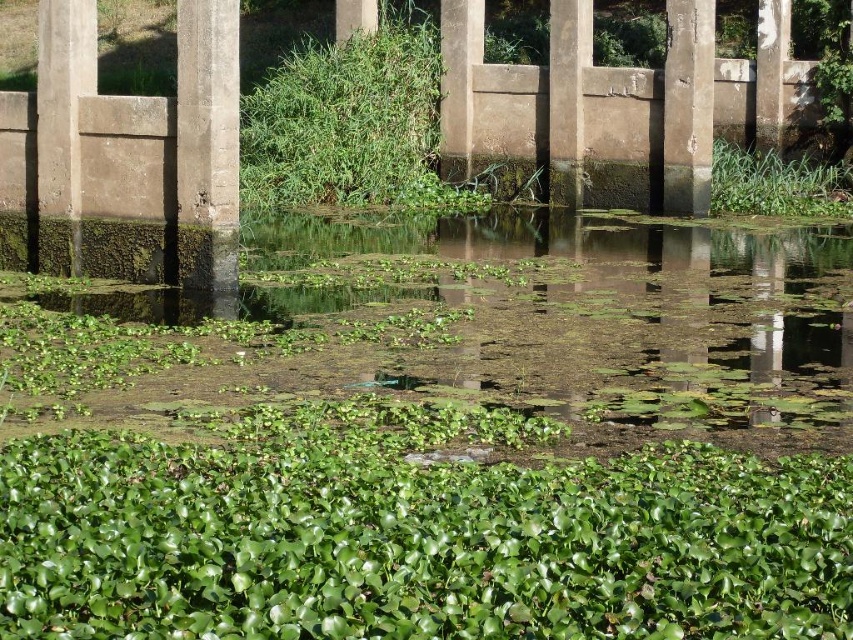
You are standing on the bank of the water body and see both the smooth concrete pillar at right and the green leafy plant at right. Which object is nearer to you?

The smooth concrete pillar at right is closer to the viewer than the green leafy plant at right, so the smooth concrete pillar at right is nearer to you.